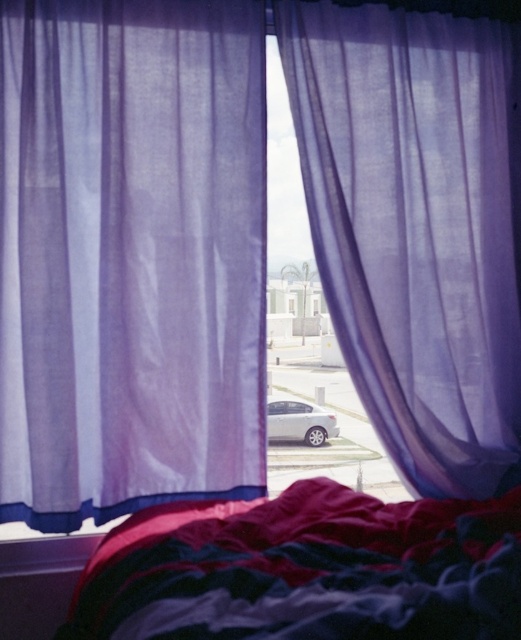
Who is taller, sheer purple curtain at left or velvet-like red blanket at lower center?

sheer purple curtain at left

Which is more to the right, sheer purple curtain at left or velvet-like red blanket at lower center?

From the viewer's perspective, velvet-like red blanket at lower center appears more on the right side.

Who is more distant from viewer, (81, 1) or (276, 500)?

Point (81, 1)

At what (x,y) coordinates should I click in order to perform the action: click on sheer purple curtain at left. Please return your answer as a coordinate pair (x, y). This screenshot has width=521, height=640. Looking at the image, I should click on (130, 256).

Which is in front, point (187, 595) or point (294, 401)?

Positioned in front is point (187, 595).

Does velvet-like red blanket at lower center lie in front of satin silver sedan at center?

Yes, velvet-like red blanket at lower center is closer to the viewer.

The height and width of the screenshot is (640, 521). Describe the element at coordinates (306, 570) in the screenshot. I see `velvet-like red blanket at lower center` at that location.

Where is `velvet-like red blanket at lower center`? velvet-like red blanket at lower center is located at coordinates (306, 570).

Between sheer purple curtain at left and translucent purple curtain at center, which one appears on the right side from the viewer's perspective?

From the viewer's perspective, translucent purple curtain at center appears more on the right side.

Which of these two, sheer purple curtain at left or translucent purple curtain at center, stands taller?

With more height is sheer purple curtain at left.

Does point (57, 99) come closer to viewer compared to point (341, 170)?

Yes, point (57, 99) is in front of point (341, 170).

The image size is (521, 640). I want to click on sheer purple curtain at left, so click(130, 256).